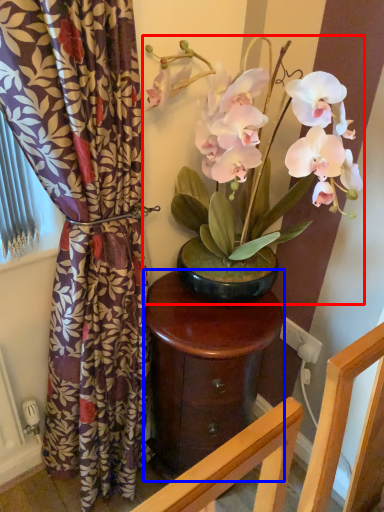
Question: Which point is further to the camera, houseplant (highlighted by a red box) or table (highlighted by a blue box)?

Choices:
 (A) houseplant
 (B) table

Answer: (B)